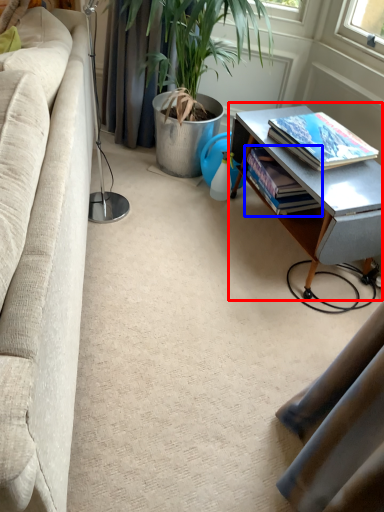
Question: Which point is closer to the camera, table (highlighted by a red box) or book (highlighted by a blue box)?

Choices:
 (A) table
 (B) book

Answer: (A)